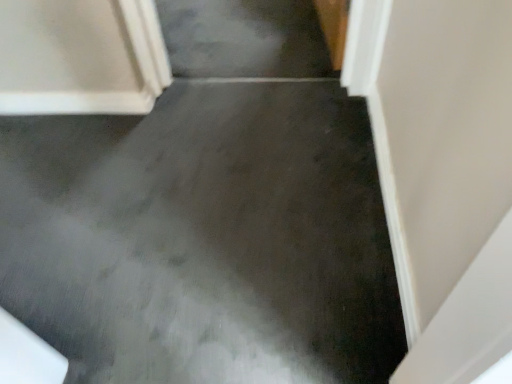
Describe the element at coordinates (204, 239) in the screenshot. I see `gray concrete at center` at that location.

In order to face gray concrete at center, should I rotate leftwards or rightwards?

You should look left and rotate roughly 13.694 degrees.

I want to click on gray concrete at center, so click(x=204, y=239).

Where is `gray concrete at center`? This screenshot has height=384, width=512. gray concrete at center is located at coordinates (204, 239).